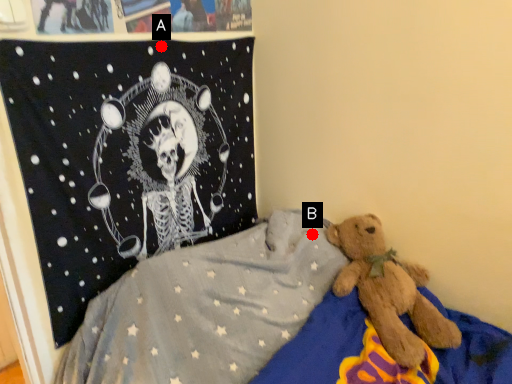
Question: Two points are circled on the image, labeled by A and B beside each circle. Which point is closer to the camera?

Choices:
 (A) A is closer
 (B) B is closer

Answer: (A)